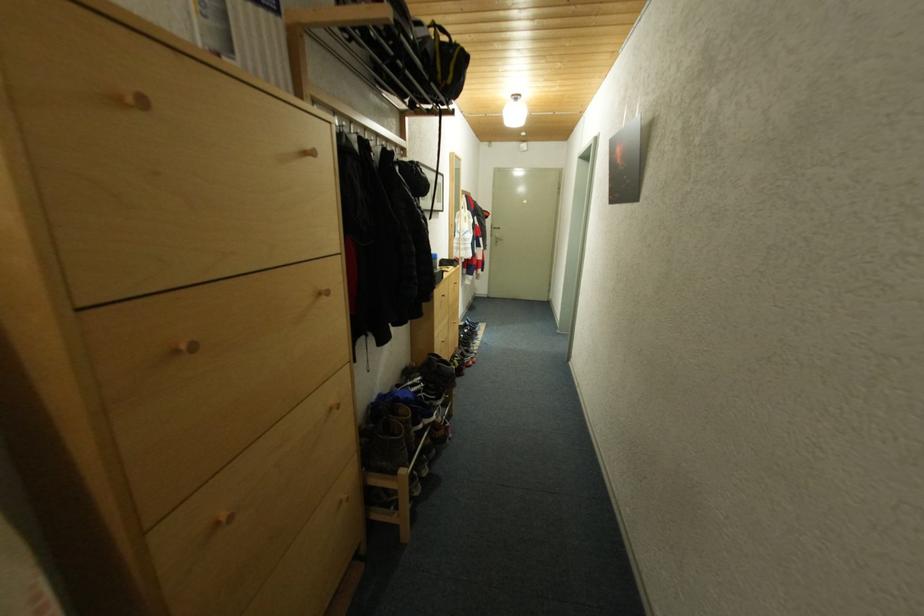
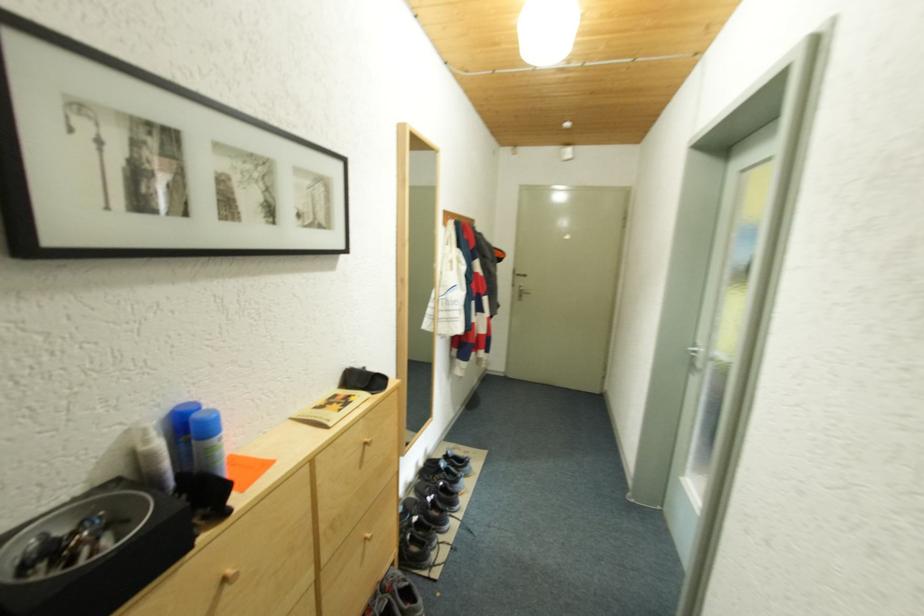
Question: In a continuous first-person perspective shot, in which direction is the camera moving?

Choices:
 (A) Left
 (B) Right
 (C) Forward
 (D) Backward

Answer: (C)